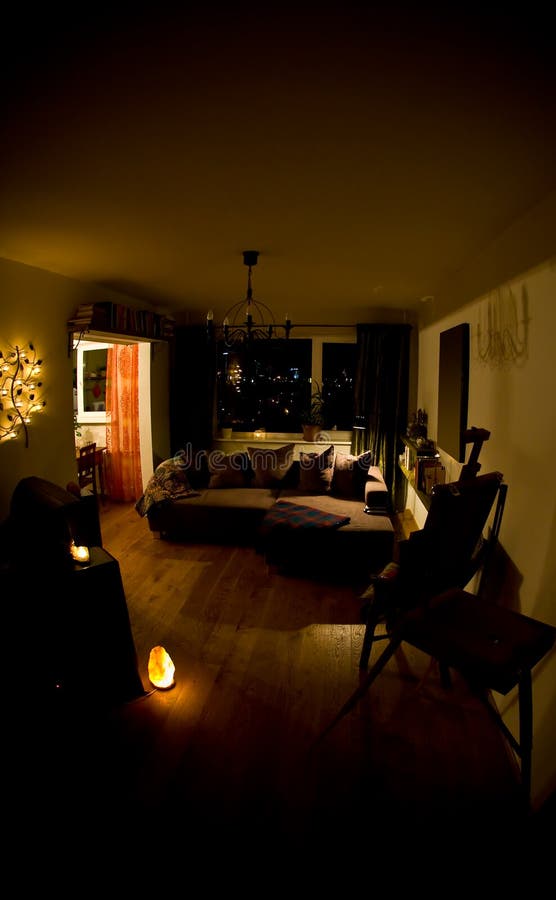
Find the location of a particular element. This screenshot has height=900, width=556. shadow of chandelier is located at coordinates (504, 334).